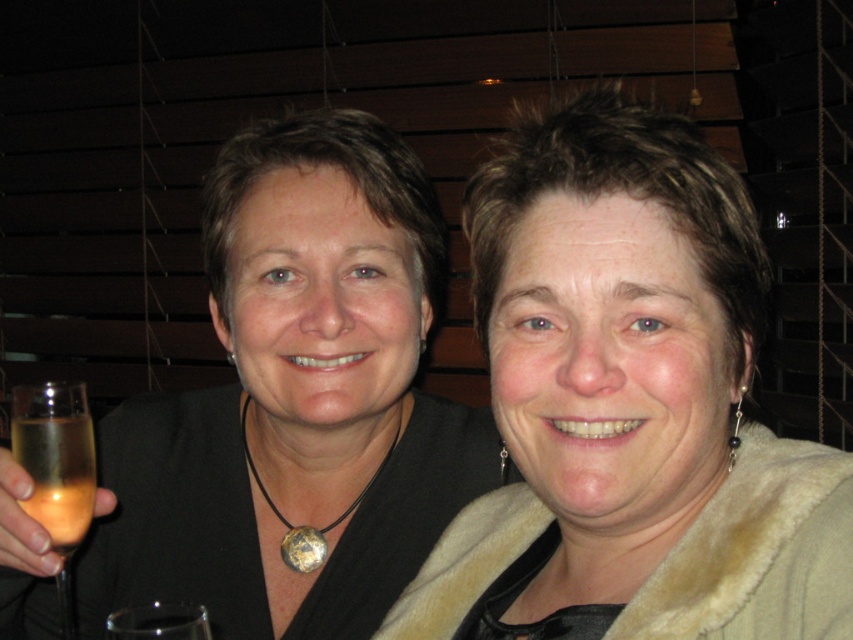
Question: Does matte black top at center have a smaller size compared to translucent glass at left?

Choices:
 (A) yes
 (B) no

Answer: (B)

Question: Estimate the real-world distances between objects in this image. Which object is farther from the matte black top at center?

Choices:
 (A) translucent glass at left
 (B) fuzzy beige coat at center

Answer: (B)

Question: From the image, what is the correct spatial relationship of fuzzy beige coat at center in relation to translucent glass at left?

Choices:
 (A) right
 (B) left

Answer: (A)

Question: Which object is positioned farthest from the matte black top at center?

Choices:
 (A) fuzzy beige coat at center
 (B) translucent glass at left

Answer: (A)

Question: Is fuzzy beige coat at center below matte black top at center?

Choices:
 (A) yes
 (B) no

Answer: (B)

Question: Which point is closer to the camera taking this photo?

Choices:
 (A) (78, 538)
 (B) (538, 396)
 (C) (496, 461)

Answer: (B)